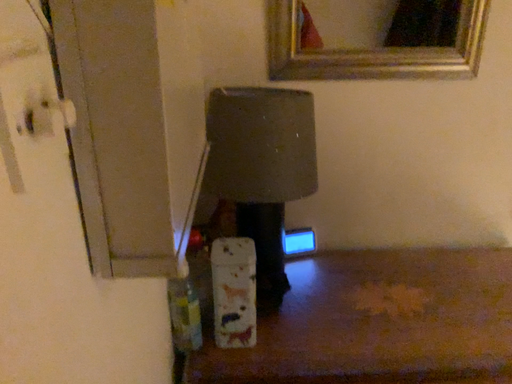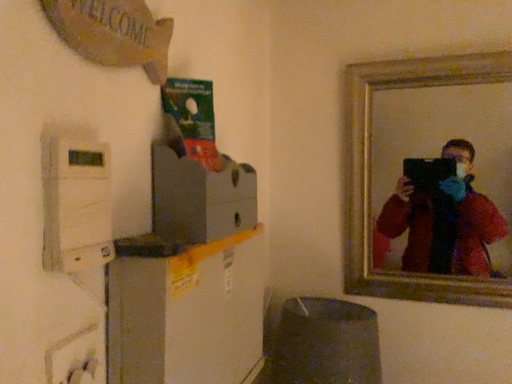
Question: Which way did the camera rotate in the video?

Choices:
 (A) rotated downward
 (B) rotated upward

Answer: (B)